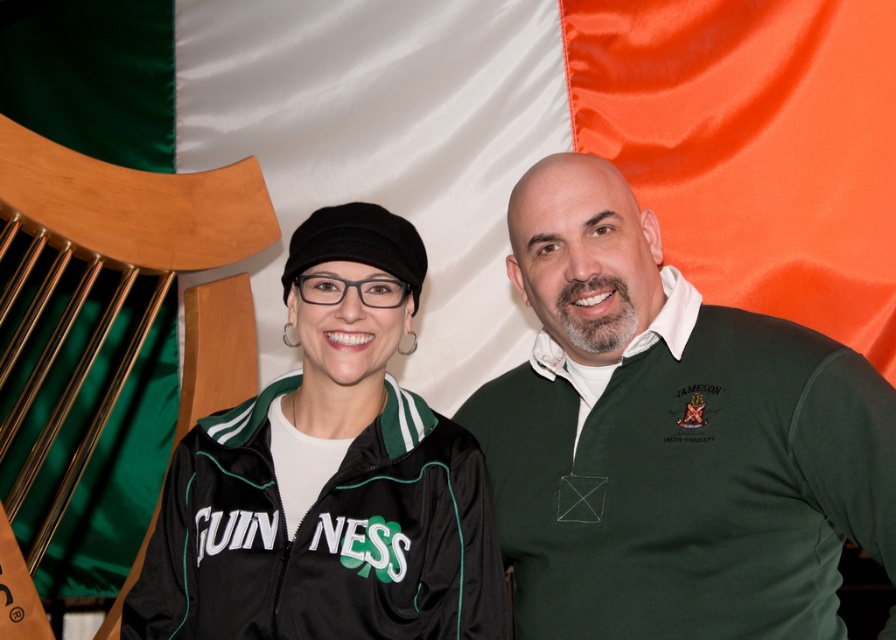
Can you confirm if green jersey at center is positioned to the right of black fabric jacket at center?

Correct, you'll find green jersey at center to the right of black fabric jacket at center.

The width and height of the screenshot is (896, 640). I want to click on green jersey at center, so click(670, 438).

The image size is (896, 640). I want to click on green jersey at center, so [x=670, y=438].